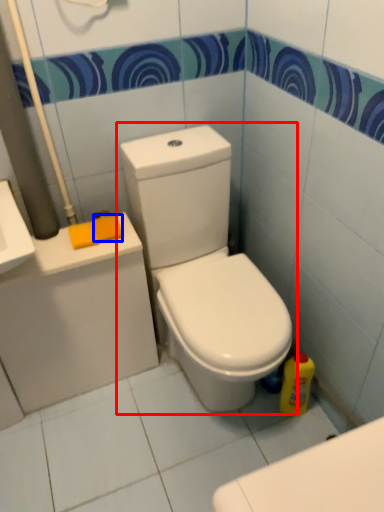
Question: Which point is closer to the camera, toilet (highlighted by a red box) or soap (highlighted by a blue box)?

Choices:
 (A) toilet
 (B) soap

Answer: (A)